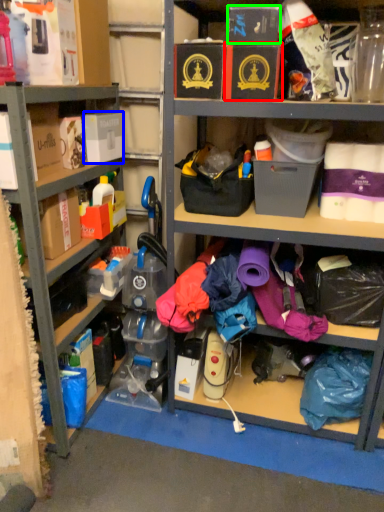
Question: Which object is positioned closest to storage box (highlighted by a red box)? Select from storage box (highlighted by a blue box) and storage box (highlighted by a green box).

Choices:
 (A) storage box
 (B) storage box

Answer: (B)